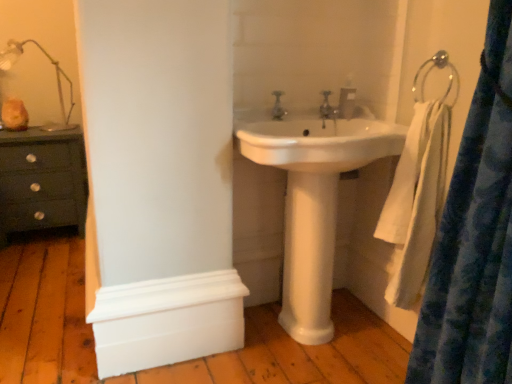
At what (x,y) coordinates should I click in order to perform the action: click on vacant space situated on the left part of silver metallic faucet at center, acting as the first tap starting from the back. Please return your answer as a coordinate pair (x, y). Looking at the image, I should click on (298, 113).